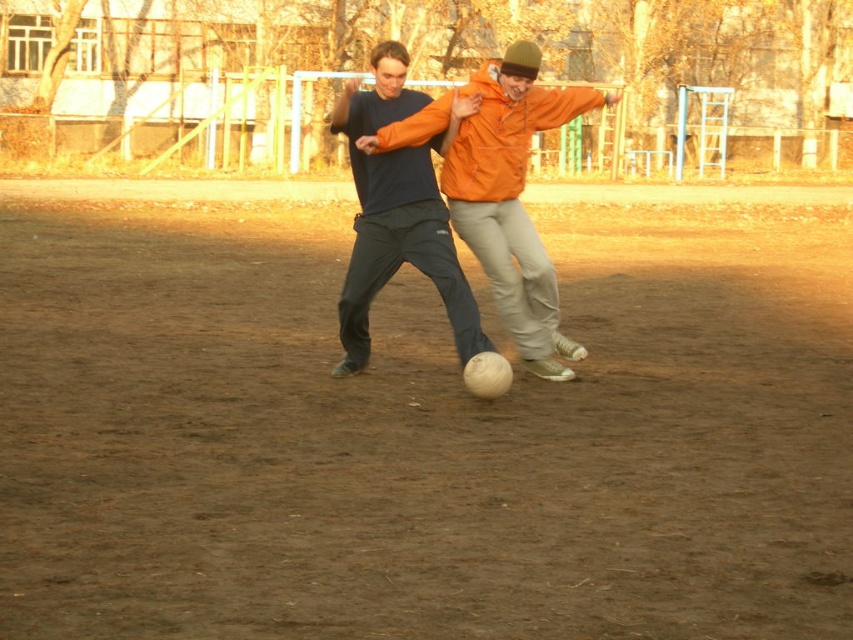
You are a soccer referee observing the game. You notice the orange matte jacket at center and the matte black pants at center. Which one appears larger in size?

The orange matte jacket at center is bigger than the matte black pants at center, so the orange matte jacket at center appears larger in size.

You are standing at the camera position and want to kick the soccer ball located at point (x=602, y=464). If your maximum kicking distance is 5 meters, can you reach it?

The distance between the camera and the soccer ball at point (x=602, y=464) is 5.01 meters, which is slightly beyond your maximum kicking distance of 5 meters. Therefore, you cannot reach it.

What are the coordinates of the brown dirt field at center?

The coordinates of the brown dirt field at center are at point (x=416, y=429).